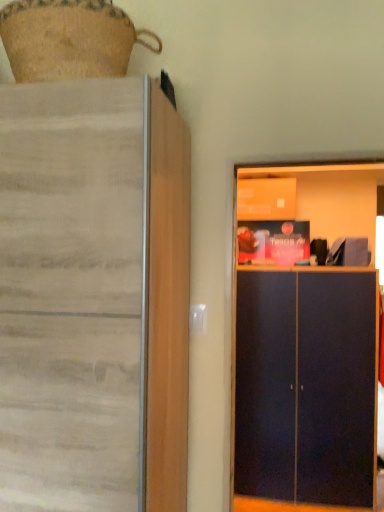
Describe the element at coordinates (305, 341) in the screenshot. The height and width of the screenshot is (512, 384). I see `dark blue matte cabinet at right` at that location.

The width and height of the screenshot is (384, 512). I want to click on dark blue matte cabinet at right, so click(x=305, y=341).

The width and height of the screenshot is (384, 512). Identify the location of matte wood cupboard at left. (93, 297).

This screenshot has width=384, height=512. What do you see at coordinates (93, 297) in the screenshot?
I see `matte wood cupboard at left` at bounding box center [93, 297].

The width and height of the screenshot is (384, 512). In order to click on dark blue matte cabinet at right in this screenshot , I will do `click(305, 341)`.

Is matte wood cupboard at left to the right of dark blue matte cabinet at right from the viewer's perspective?

Incorrect, matte wood cupboard at left is not on the right side of dark blue matte cabinet at right.

In the image, is matte wood cupboard at left positioned in front of or behind dark blue matte cabinet at right?

Visually, matte wood cupboard at left is located in front of dark blue matte cabinet at right.

Does point (115, 492) appear closer or farther from the camera than point (328, 222)?

Point (115, 492) appears to be closer to the viewer than point (328, 222).

From the image's perspective, between matte wood cupboard at left and dark blue matte cabinet at right, who is located below?

dark blue matte cabinet at right is shown below in the image.

From a real-world perspective, who is located higher, matte wood cupboard at left or dark blue matte cabinet at right?

In real-world perspective, matte wood cupboard at left is above.

Considering the sizes of matte wood cupboard at left and dark blue matte cabinet at right in the image, is matte wood cupboard at left wider or thinner than dark blue matte cabinet at right?

matte wood cupboard at left is wider than dark blue matte cabinet at right.

Considering the sizes of matte wood cupboard at left and dark blue matte cabinet at right in the image, is matte wood cupboard at left taller or shorter than dark blue matte cabinet at right?

matte wood cupboard at left is taller than dark blue matte cabinet at right.

Considering the sizes of objects matte wood cupboard at left and dark blue matte cabinet at right in the image provided, who is smaller, matte wood cupboard at left or dark blue matte cabinet at right?

dark blue matte cabinet at right is smaller.

Is matte wood cupboard at left outside of dark blue matte cabinet at right?

Yes, matte wood cupboard at left is not within dark blue matte cabinet at right.

Would you consider matte wood cupboard at left to be distant from dark blue matte cabinet at right?

Yes.

Is matte wood cupboard at left aimed at dark blue matte cabinet at right?

No, matte wood cupboard at left is not aimed at dark blue matte cabinet at right.

Locate an element on the screen. dresser on the right of the matte wood cupboard at left is located at coordinates (305, 341).

Based on their positions, is dark blue matte cabinet at right located to the left or right of matte wood cupboard at left?

Clearly, dark blue matte cabinet at right is on the right of matte wood cupboard at left in the image.

Consider the image. Is dark blue matte cabinet at right closer to the viewer compared to matte wood cupboard at left?

No, dark blue matte cabinet at right is further to the viewer.

Does point (355, 276) appear closer or farther from the camera than point (169, 290)?

Point (355, 276) is farther from the camera than point (169, 290).

From the image's perspective, between dark blue matte cabinet at right and matte wood cupboard at left, who is located below?

dark blue matte cabinet at right appears lower in the image.

From a real-world perspective, is dark blue matte cabinet at right beneath matte wood cupboard at left?

Yes, from a real-world perspective, dark blue matte cabinet at right is under matte wood cupboard at left.

Considering the sizes of objects dark blue matte cabinet at right and matte wood cupboard at left in the image provided, who is wider, dark blue matte cabinet at right or matte wood cupboard at left?

With larger width is matte wood cupboard at left.

Is dark blue matte cabinet at right shorter than matte wood cupboard at left?

Correct, dark blue matte cabinet at right is not as tall as matte wood cupboard at left.

Considering the sizes of objects dark blue matte cabinet at right and matte wood cupboard at left in the image provided, who is smaller, dark blue matte cabinet at right or matte wood cupboard at left?

With smaller size is dark blue matte cabinet at right.

Is dark blue matte cabinet at right spatially inside matte wood cupboard at left, or outside of it?

dark blue matte cabinet at right is not inside matte wood cupboard at left, it's outside.

Is there a large distance between dark blue matte cabinet at right and matte wood cupboard at left?

Yes.

Could you tell me if dark blue matte cabinet at right is turned towards matte wood cupboard at left?

No, dark blue matte cabinet at right is not turned towards matte wood cupboard at left.

How much distance is there between dark blue matte cabinet at right and matte wood cupboard at left?

dark blue matte cabinet at right is 1.66 meters from matte wood cupboard at left.

Locate an element on the screen. cupboard on the left of dark blue matte cabinet at right is located at coordinates [x=93, y=297].

The image size is (384, 512). What are the coordinates of `cupboard above the dark blue matte cabinet at right (from the image's perspective)` in the screenshot? It's located at (93, 297).

Where is `cupboard that appears in front of the dark blue matte cabinet at right`? The height and width of the screenshot is (512, 384). cupboard that appears in front of the dark blue matte cabinet at right is located at coordinates (93, 297).